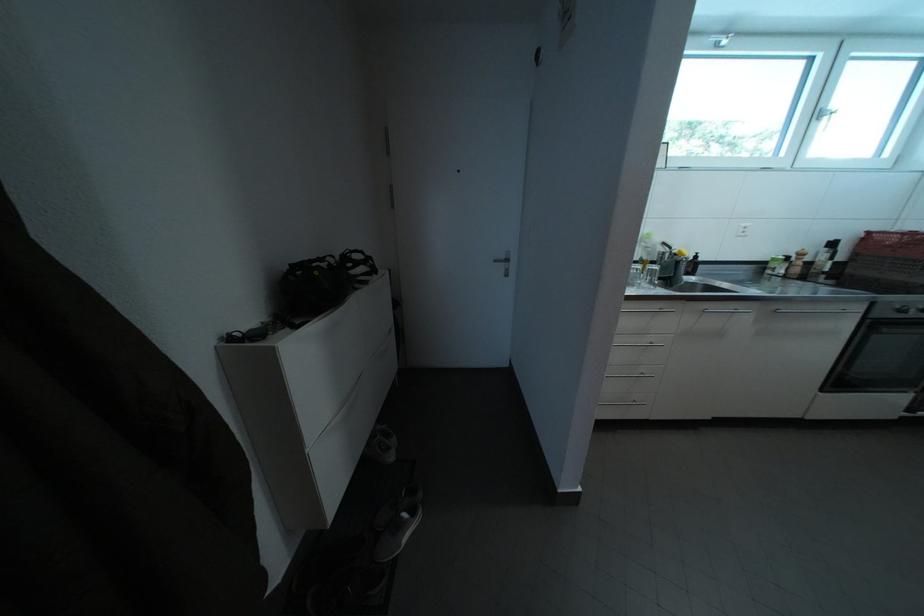
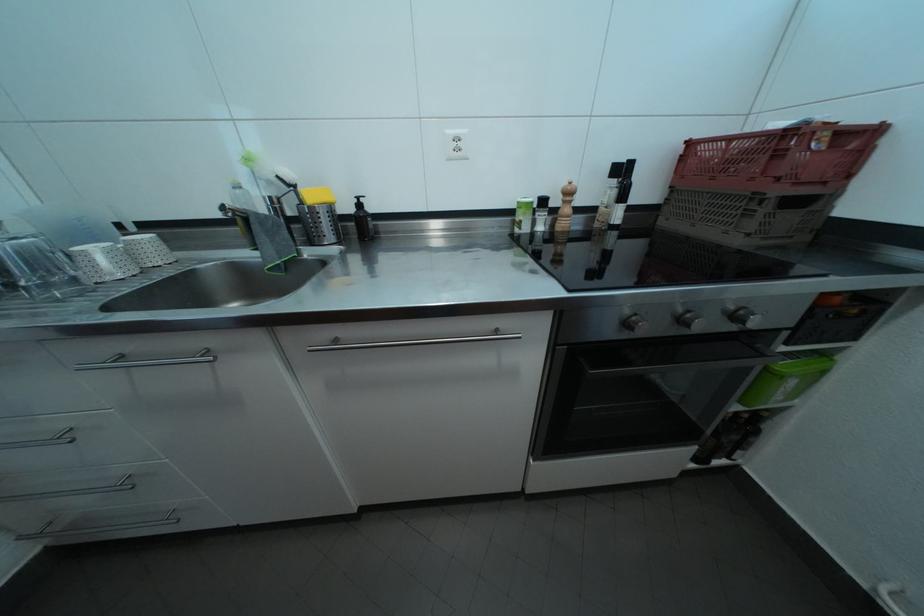
Locate, in the second image, the point that corresponds to (x=679, y=254) in the first image.

(304, 192)